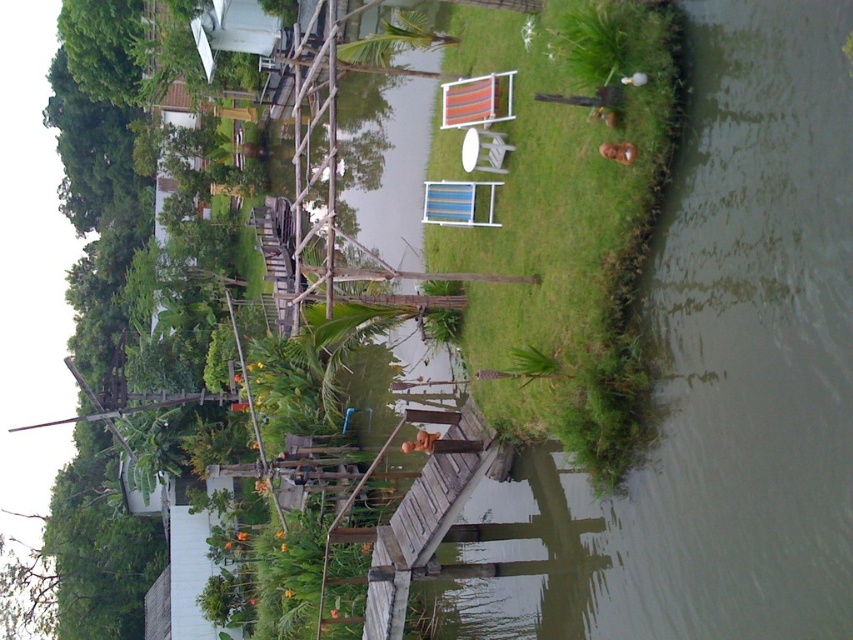
You are standing on the wooden walkway and want to move towards the green grassy water at right. Which direction should you walk relative to the green grass at center?

To reach the green grassy water at right from the green grass at center, you should walk to the right since the green grassy water at right is located to the right of the green grass at center.

You are standing on the wooden walkway and want to move towards the green grass at center. Which direction should you go to avoid the green grassy water at right?

To reach the green grass at center while avoiding the green grassy water at right, you should move towards the left side of the walkway since the green grassy water at right is closer to you and positioned to the right side of the scene.

You are standing at point (634, 275) and want to walk to point (498, 484). Is the destination behind you or in front of you?

The destination point (498, 484) is behind point (634, 275), so it would be behind you if you are standing at point (634, 275).